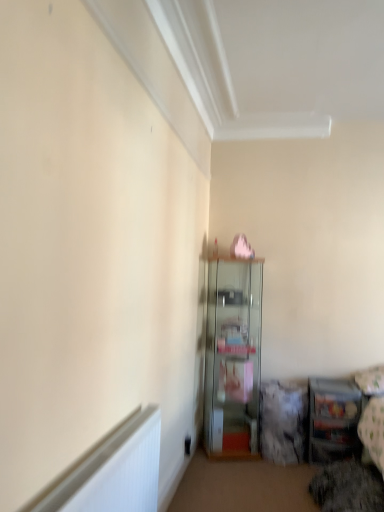
Describe the element at coordinates (333, 419) in the screenshot. The height and width of the screenshot is (512, 384). I see `metallic glass shelf at lower right, which ranks as the 2th shelf in left-to-right order` at that location.

This screenshot has width=384, height=512. Find the location of `metallic glass shelf at lower right, which appears as the 1th shelf when viewed from the right`. metallic glass shelf at lower right, which appears as the 1th shelf when viewed from the right is located at coordinates (333, 419).

What is the approximate width of metallic glass shelf at lower right, which appears as the 1th shelf when viewed from the right?

18.62 inches.

This screenshot has width=384, height=512. What do you see at coordinates (233, 356) in the screenshot?
I see `clear glass cabinet at center, which is counted as the 1th shelf, starting from the left` at bounding box center [233, 356].

Image resolution: width=384 pixels, height=512 pixels. Identify the location of clear glass cabinet at center, which is counted as the 1th shelf, starting from the left. (233, 356).

In order to face clear glass cabinet at center, the 2th shelf in the right-to-left sequence, should I rotate leftwards or rightwards?

It's best to rotate right around 5.753 degrees.

Find the location of a particular element. The image size is (384, 512). metallic glass shelf at lower right, which ranks as the 2th shelf in left-to-right order is located at coordinates (333, 419).

Considering the positions of objects clear glass cabinet at center, the 2th shelf in the right-to-left sequence, and metallic glass shelf at lower right, which appears as the 1th shelf when viewed from the right, in the image provided, who is more to the left, clear glass cabinet at center, the 2th shelf in the right-to-left sequence, or metallic glass shelf at lower right, which appears as the 1th shelf when viewed from the right,?

clear glass cabinet at center, the 2th shelf in the right-to-left sequence.

Is clear glass cabinet at center, the 2th shelf in the right-to-left sequence, in front of or behind metallic glass shelf at lower right, which ranks as the 2th shelf in left-to-right order, in the image?

clear glass cabinet at center, the 2th shelf in the right-to-left sequence, is behind metallic glass shelf at lower right, which ranks as the 2th shelf in left-to-right order.

Considering the positions of point (246, 418) and point (346, 431), is point (246, 418) closer or farther from the camera than point (346, 431)?

Point (246, 418) is farther from the camera than point (346, 431).

From the image's perspective, is clear glass cabinet at center, the 2th shelf in the right-to-left sequence, beneath metallic glass shelf at lower right, which ranks as the 2th shelf in left-to-right order?

Incorrect, from the image's perspective, clear glass cabinet at center, the 2th shelf in the right-to-left sequence, is higher than metallic glass shelf at lower right, which ranks as the 2th shelf in left-to-right order.

From a real-world perspective, which object stands above the other?

From a 3D spatial view, clear glass cabinet at center, the 2th shelf in the right-to-left sequence, is above.

Considering the sizes of objects clear glass cabinet at center, the 2th shelf in the right-to-left sequence, and metallic glass shelf at lower right, which appears as the 1th shelf when viewed from the right, in the image provided, who is thinner, clear glass cabinet at center, the 2th shelf in the right-to-left sequence, or metallic glass shelf at lower right, which appears as the 1th shelf when viewed from the right,?

metallic glass shelf at lower right, which appears as the 1th shelf when viewed from the right, is thinner.

Does clear glass cabinet at center, which is counted as the 1th shelf, starting from the left, have a lesser height compared to metallic glass shelf at lower right, which appears as the 1th shelf when viewed from the right?

Incorrect, the height of clear glass cabinet at center, which is counted as the 1th shelf, starting from the left, does not fall short of that of metallic glass shelf at lower right, which appears as the 1th shelf when viewed from the right.

Considering the sizes of objects clear glass cabinet at center, the 2th shelf in the right-to-left sequence, and metallic glass shelf at lower right, which ranks as the 2th shelf in left-to-right order, in the image provided, who is smaller, clear glass cabinet at center, the 2th shelf in the right-to-left sequence, or metallic glass shelf at lower right, which ranks as the 2th shelf in left-to-right order,?

metallic glass shelf at lower right, which ranks as the 2th shelf in left-to-right order, is smaller.

Could metallic glass shelf at lower right, which ranks as the 2th shelf in left-to-right order, be considered to be inside clear glass cabinet at center, the 2th shelf in the right-to-left sequence?

That's incorrect, metallic glass shelf at lower right, which ranks as the 2th shelf in left-to-right order, is not inside clear glass cabinet at center, the 2th shelf in the right-to-left sequence.

Can you see clear glass cabinet at center, the 2th shelf in the right-to-left sequence, touching metallic glass shelf at lower right, which appears as the 1th shelf when viewed from the right?

No, clear glass cabinet at center, the 2th shelf in the right-to-left sequence, is not in contact with metallic glass shelf at lower right, which appears as the 1th shelf when viewed from the right.

Is clear glass cabinet at center, which is counted as the 1th shelf, starting from the left, turned away from metallic glass shelf at lower right, which ranks as the 2th shelf in left-to-right order?

No, metallic glass shelf at lower right, which ranks as the 2th shelf in left-to-right order, is not at the back of clear glass cabinet at center, which is counted as the 1th shelf, starting from the left.

What's the angular difference between clear glass cabinet at center, which is counted as the 1th shelf, starting from the left, and metallic glass shelf at lower right, which appears as the 1th shelf when viewed from the right,'s facing directions?

15.3 degrees separate the facing orientations of clear glass cabinet at center, which is counted as the 1th shelf, starting from the left, and metallic glass shelf at lower right, which appears as the 1th shelf when viewed from the right.

Measure the distance from clear glass cabinet at center, which is counted as the 1th shelf, starting from the left, to metallic glass shelf at lower right, which appears as the 1th shelf when viewed from the right.

clear glass cabinet at center, which is counted as the 1th shelf, starting from the left, and metallic glass shelf at lower right, which appears as the 1th shelf when viewed from the right, are 28.08 inches apart from each other.

Where is `shelf located above the metallic glass shelf at lower right, which ranks as the 2th shelf in left-to-right order (from the image's perspective)`? This screenshot has width=384, height=512. shelf located above the metallic glass shelf at lower right, which ranks as the 2th shelf in left-to-right order (from the image's perspective) is located at coordinates (233, 356).

Considering the positions of objects metallic glass shelf at lower right, which appears as the 1th shelf when viewed from the right, and clear glass cabinet at center, which is counted as the 1th shelf, starting from the left, in the image provided, who is more to the left, metallic glass shelf at lower right, which appears as the 1th shelf when viewed from the right, or clear glass cabinet at center, which is counted as the 1th shelf, starting from the left,?

From the viewer's perspective, clear glass cabinet at center, which is counted as the 1th shelf, starting from the left, appears more on the left side.

Relative to clear glass cabinet at center, which is counted as the 1th shelf, starting from the left, is metallic glass shelf at lower right, which ranks as the 2th shelf in left-to-right order, in front or behind?

metallic glass shelf at lower right, which ranks as the 2th shelf in left-to-right order, is positioned closer to the viewer than clear glass cabinet at center, which is counted as the 1th shelf, starting from the left.

Which is behind, point (326, 404) or point (252, 406)?

Point (252, 406)

From the image's perspective, is metallic glass shelf at lower right, which ranks as the 2th shelf in left-to-right order, over clear glass cabinet at center, which is counted as the 1th shelf, starting from the left?

Actually, metallic glass shelf at lower right, which ranks as the 2th shelf in left-to-right order, appears below clear glass cabinet at center, which is counted as the 1th shelf, starting from the left, in the image.

Based on the photo, from a real-world perspective, is metallic glass shelf at lower right, which ranks as the 2th shelf in left-to-right order, located higher than clear glass cabinet at center, the 2th shelf in the right-to-left sequence?

Actually, metallic glass shelf at lower right, which ranks as the 2th shelf in left-to-right order, is physically below clear glass cabinet at center, the 2th shelf in the right-to-left sequence, in the real world.

Which object is wider, metallic glass shelf at lower right, which ranks as the 2th shelf in left-to-right order, or clear glass cabinet at center, which is counted as the 1th shelf, starting from the left?

Wider between the two is clear glass cabinet at center, which is counted as the 1th shelf, starting from the left.

Can you confirm if metallic glass shelf at lower right, which appears as the 1th shelf when viewed from the right, is taller than clear glass cabinet at center, which is counted as the 1th shelf, starting from the left?

No.

Can you confirm if metallic glass shelf at lower right, which appears as the 1th shelf when viewed from the right, is bigger than clear glass cabinet at center, the 2th shelf in the right-to-left sequence?

Incorrect, metallic glass shelf at lower right, which appears as the 1th shelf when viewed from the right, is not larger than clear glass cabinet at center, the 2th shelf in the right-to-left sequence.

Does metallic glass shelf at lower right, which ranks as the 2th shelf in left-to-right order, contain clear glass cabinet at center, which is counted as the 1th shelf, starting from the left?

That's incorrect, clear glass cabinet at center, which is counted as the 1th shelf, starting from the left, is not inside metallic glass shelf at lower right, which ranks as the 2th shelf in left-to-right order.

Is metallic glass shelf at lower right, which ranks as the 2th shelf in left-to-right order, directly adjacent to clear glass cabinet at center, the 2th shelf in the right-to-left sequence?

metallic glass shelf at lower right, which ranks as the 2th shelf in left-to-right order, and clear glass cabinet at center, the 2th shelf in the right-to-left sequence, are not in contact.

Could you tell me if metallic glass shelf at lower right, which appears as the 1th shelf when viewed from the right, is facing clear glass cabinet at center, the 2th shelf in the right-to-left sequence?

No, metallic glass shelf at lower right, which appears as the 1th shelf when viewed from the right, is not oriented towards clear glass cabinet at center, the 2th shelf in the right-to-left sequence.

What's the angular difference between metallic glass shelf at lower right, which ranks as the 2th shelf in left-to-right order, and clear glass cabinet at center, which is counted as the 1th shelf, starting from the left,'s facing directions?

There is a 15.3-degree angle between the facing directions of metallic glass shelf at lower right, which ranks as the 2th shelf in left-to-right order, and clear glass cabinet at center, which is counted as the 1th shelf, starting from the left.

Locate an element on the screen. The image size is (384, 512). shelf lying behind the metallic glass shelf at lower right, which appears as the 1th shelf when viewed from the right is located at coordinates pyautogui.click(x=233, y=356).

This screenshot has width=384, height=512. What are the coordinates of `shelf that appears above the metallic glass shelf at lower right, which appears as the 1th shelf when viewed from the right (from the image's perspective)` in the screenshot? It's located at (233, 356).

Find the location of a particular element. This screenshot has width=384, height=512. shelf above the metallic glass shelf at lower right, which ranks as the 2th shelf in left-to-right order (from a real-world perspective) is located at coordinates tap(233, 356).